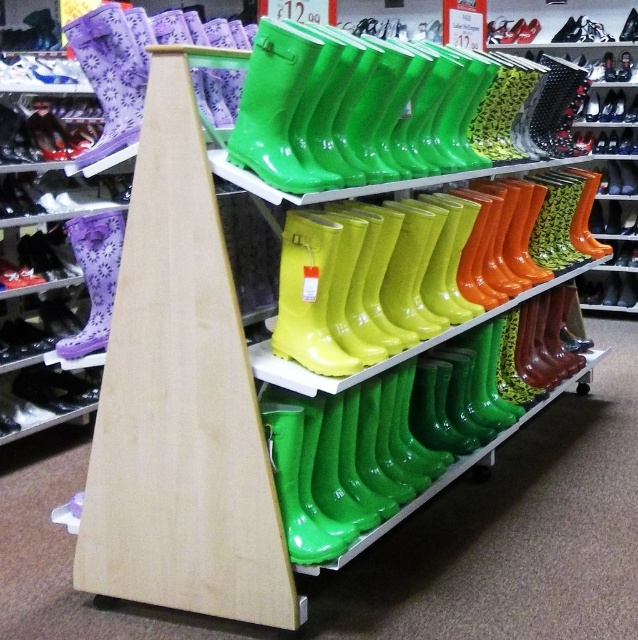
Question: Does glossy rubber boots at center have a smaller size compared to matte black shoe at lower left?

Choices:
 (A) yes
 (B) no

Answer: (B)

Question: Which point appears farthest from the camera in this image?

Choices:
 (A) (315, 358)
 (B) (40, 378)

Answer: (B)

Question: Which object appears farthest from the camera in this image?

Choices:
 (A) glossy rubber boots at center
 (B) matte black shoe at lower left

Answer: (B)

Question: Does glossy rubber boots at center appear over matte black shoe at lower left?

Choices:
 (A) yes
 (B) no

Answer: (A)

Question: Does glossy rubber boots at center have a larger size compared to matte black shoe at lower left?

Choices:
 (A) no
 (B) yes

Answer: (B)